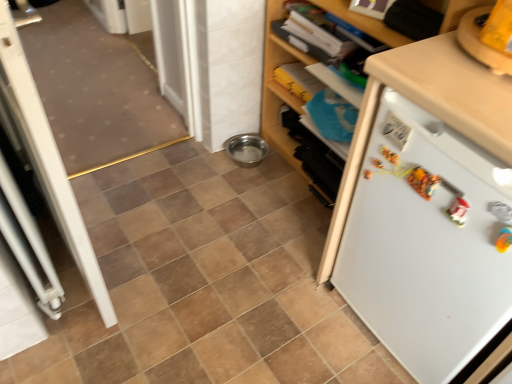
Image resolution: width=512 pixels, height=384 pixels. Find the location of `brown matte tile at center`. brown matte tile at center is located at coordinates (202, 282).

Identify the location of white plastic screen door at left. (42, 150).

At what (x,y) coordinates should I click in order to perform the action: click on brown matte tile at center. Please return your answer as a coordinate pair (x, y). The height and width of the screenshot is (384, 512). Looking at the image, I should click on (202, 282).

In the scene shown: Is there a large distance between white matte refrigerator at right and brown matte tile at center?

No, white matte refrigerator at right is not far from brown matte tile at center.

Which of these two, white matte refrigerator at right or brown matte tile at center, is wider?

With larger width is brown matte tile at center.

Identify the location of refrigerator lying on the right of brown matte tile at center. (428, 208).

Which object is further away from the camera taking this photo, white matte refrigerator at right or brown matte tile at center?

brown matte tile at center.

From a real-world perspective, who is located lower, white matte cabinet at upper right or white matte refrigerator at right?

From a 3D spatial view, white matte refrigerator at right is below.

At what (x,y) coordinates should I click in order to perform the action: click on cabinetry above the white matte refrigerator at right (from the image's perspective). Please return your answer as a coordinate pair (x, y). The image size is (512, 384). Looking at the image, I should click on (279, 84).

Would you say white matte cabinet at upper right is inside or outside white matte refrigerator at right?

white matte cabinet at upper right is outside white matte refrigerator at right.

How far apart are brown matte tile at center and white matte cabinet at upper right?

brown matte tile at center and white matte cabinet at upper right are 26.22 inches apart from each other.

Is brown matte tile at center in contact with white matte cabinet at upper right?

No, brown matte tile at center is not in contact with white matte cabinet at upper right.

Which object is further away from the camera, brown matte tile at center or white matte cabinet at upper right?

white matte cabinet at upper right is behind.

Between brown matte tile at center and white matte cabinet at upper right, which one has smaller size?

brown matte tile at center.

At what (x,y) coordinates should I click in order to perform the action: click on screen door above the white matte refrigerator at right (from the image's perspective). Please return your answer as a coordinate pair (x, y). The image size is (512, 384). Looking at the image, I should click on (42, 150).

Is white matte refrigerator at right closer to the viewer compared to white plastic screen door at left?

Yes, white matte refrigerator at right is closer to the camera.

Is white matte refrigerator at right to the right of white plastic screen door at left from the viewer's perspective?

Yes.

Is white matte refrigerator at right oriented towards white matte cabinet at upper right?

No, white matte refrigerator at right is not turned towards white matte cabinet at upper right.

Between white matte refrigerator at right and white matte cabinet at upper right, which one has less height?

white matte refrigerator at right is shorter.

Measure the distance from white matte refrigerator at right to white matte cabinet at upper right.

The distance of white matte refrigerator at right from white matte cabinet at upper right is 20.96 inches.

You are a GUI agent. You are given a task and a screenshot of the screen. Output one action in this format:
    pyautogui.click(x=<x>, y=<y>)
    Task: Click on the refrigerator lying in front of the white matte cabinet at upper right
    Image resolution: width=512 pixels, height=384 pixels.
    Given the screenshot: What is the action you would take?
    pyautogui.click(x=428, y=208)

How many degrees apart are the facing directions of white plastic screen door at left and brown matte tile at center?

There is a 88.3-degree angle between the facing directions of white plastic screen door at left and brown matte tile at center.

In terms of width, does white plastic screen door at left look wider or thinner when compared to brown matte tile at center?

Clearly, white plastic screen door at left has less width compared to brown matte tile at center.

Does white plastic screen door at left contain brown matte tile at center?

No, brown matte tile at center is not surrounded by white plastic screen door at left.

Where is `ceramic tile below the white plastic screen door at left (from a real-world perspective)`? ceramic tile below the white plastic screen door at left (from a real-world perspective) is located at coordinates (202, 282).

Could white matte refrigerator at right be considered to be inside white plastic screen door at left?

That's incorrect, white matte refrigerator at right is not inside white plastic screen door at left.

Is white plastic screen door at left bigger or smaller than white matte refrigerator at right?

In the image, white plastic screen door at left appears to be smaller than white matte refrigerator at right.

Considering the sizes of objects white plastic screen door at left and white matte refrigerator at right in the image provided, who is wider, white plastic screen door at left or white matte refrigerator at right?

white matte refrigerator at right.

Is white plastic screen door at left not close to white matte refrigerator at right?

Actually, white plastic screen door at left and white matte refrigerator at right are a little close together.

The image size is (512, 384). I want to click on refrigerator on the right side of brown matte tile at center, so click(x=428, y=208).

Locate an element on the screen. The height and width of the screenshot is (384, 512). refrigerator below the white matte cabinet at upper right (from the image's perspective) is located at coordinates (428, 208).

Estimate the real-world distances between objects in this image. Which object is further from white matte cabinet at upper right, white matte refrigerator at right or white plastic screen door at left?

Among the two, white plastic screen door at left is located further to white matte cabinet at upper right.

Estimate the real-world distances between objects in this image. Which object is closer to white matte refrigerator at right, white plastic screen door at left or brown matte tile at center?

brown matte tile at center lies closer to white matte refrigerator at right than the other object.

Considering their positions, is white plastic screen door at left positioned further to white matte refrigerator at right than white matte cabinet at upper right?

white plastic screen door at left lies further to white matte refrigerator at right than the other object.

Considering their positions, is brown matte tile at center positioned further to white matte cabinet at upper right than white matte refrigerator at right?

brown matte tile at center is further to white matte cabinet at upper right.

Based on their spatial positions, is white plastic screen door at left or white matte cabinet at upper right further from brown matte tile at center?

Among the two, white matte cabinet at upper right is located further to brown matte tile at center.

From the image, which object appears to be farther from brown matte tile at center, white matte refrigerator at right or white matte cabinet at upper right?

white matte cabinet at upper right is further to brown matte tile at center.

When comparing their distances from brown matte tile at center, does white matte refrigerator at right or white plastic screen door at left seem closer?

Based on the image, white plastic screen door at left appears to be nearer to brown matte tile at center.

Based on their spatial positions, is brown matte tile at center or white matte refrigerator at right further from white plastic screen door at left?

white matte refrigerator at right is further to white plastic screen door at left.

You are a GUI agent. You are given a task and a screenshot of the screen. Output one action in this format:
    pyautogui.click(x=<x>, y=<y>)
    Task: Click on the cabinetry situated between white plastic screen door at left and white matte refrigerator at right from left to right
    The height and width of the screenshot is (384, 512).
    Given the screenshot: What is the action you would take?
    pyautogui.click(x=279, y=84)

The width and height of the screenshot is (512, 384). What are the coordinates of `ceramic tile situated between white plastic screen door at left and white matte cabinet at upper right from left to right` in the screenshot? It's located at (202, 282).

This screenshot has height=384, width=512. I want to click on ceramic tile between white plastic screen door at left and white matte refrigerator at right from left to right, so click(202, 282).

Find the location of a particular element. cabinetry situated between brown matte tile at center and white matte refrigerator at right from left to right is located at coordinates (279, 84).